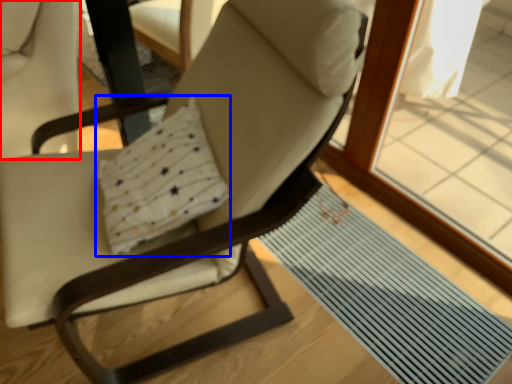
Question: Which of the following is the farthest to the observer, swivel chair (highlighted by a red box) or pillow (highlighted by a blue box)?

Choices:
 (A) swivel chair
 (B) pillow

Answer: (A)